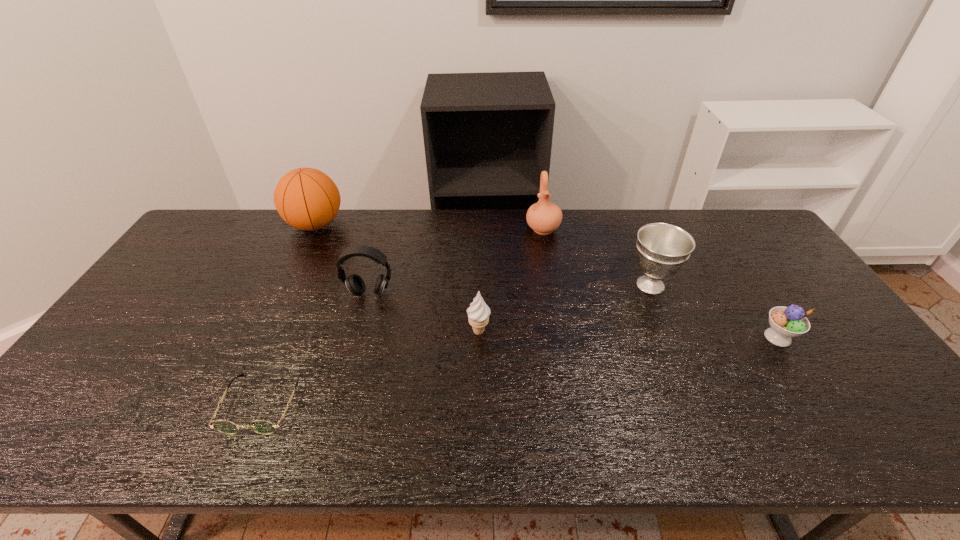
What are the coordinates of `vacant area situated on the left of the basketball` in the screenshot? It's located at (225, 225).

I want to click on vacant region located on the spout of the third object from right to left, so click(x=548, y=260).

Find the location of a particular element. The image size is (960, 540). vacant space located 0.380m on the left of the second object from right to left is located at coordinates (500, 285).

At what (x,y) coordinates should I click in order to perform the action: click on free space located 0.140m on the ear cups of the fifth object from right to left. Please return your answer as a coordinate pair (x, y). Looking at the image, I should click on (357, 339).

Identify the location of free location located on the front-facing side of the left icecream. click(556, 331).

At what (x,y) coordinates should I click in order to perform the action: click on free spot located on the back of the rightmost object. Please return your answer as a coordinate pair (x, y). The width and height of the screenshot is (960, 540). Looking at the image, I should click on (719, 246).

In order to click on basketball that is at the far edge in this screenshot , I will do `click(307, 199)`.

In order to click on pottery that is positioned at the far edge in this screenshot , I will do `click(544, 217)`.

What are the coordinates of `object at the near edge` in the screenshot? It's located at (264, 427).

Identify the location of object at the right edge. (786, 322).